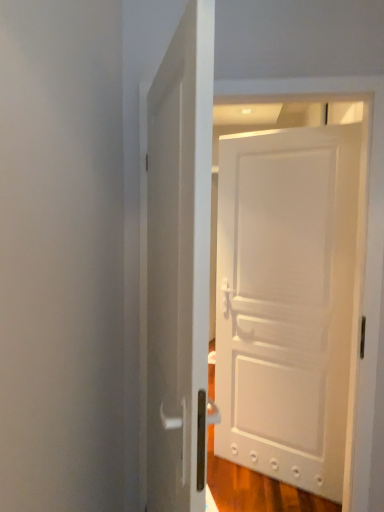
Question: Relative to white glossy door at center, which is the 2th door in right-to-left order, is white matte door at center, acting as the 1th door starting from the back, in front or behind?

Choices:
 (A) behind
 (B) front

Answer: (A)

Question: In terms of height, does white matte door at center, which is the 2th door in left-to-right order, look taller or shorter compared to white glossy door at center, which is the 2th door in right-to-left order?

Choices:
 (A) tall
 (B) short

Answer: (A)

Question: From a real-world perspective, relative to white glossy door at center, which is the 2th door in right-to-left order, is white matte door at center, which is counted as the 1th door, starting from the right, vertically above or below?

Choices:
 (A) above
 (B) below

Answer: (B)

Question: Which is correct: white glossy door at center, which is the first door in front-to-back order, is inside white matte door at center, the 2th door positioned from the front, or outside of it?

Choices:
 (A) outside
 (B) inside

Answer: (A)

Question: Considering the relative positions of white glossy door at center, which is the first door in front-to-back order, and white matte door at center, which is counted as the 1th door, starting from the right, in the image provided, is white glossy door at center, which is the first door in front-to-back order, to the left or to the right of white matte door at center, which is counted as the 1th door, starting from the right,?

Choices:
 (A) left
 (B) right

Answer: (A)

Question: Relative to white matte door at center, the 2th door positioned from the front, is white glossy door at center, placed as the 1th door when sorted from left to right, in front or behind?

Choices:
 (A) behind
 (B) front

Answer: (B)

Question: From a real-world perspective, relative to white matte door at center, the 2th door positioned from the front, is white glossy door at center, which is the first door in front-to-back order, vertically above or below?

Choices:
 (A) below
 (B) above

Answer: (B)